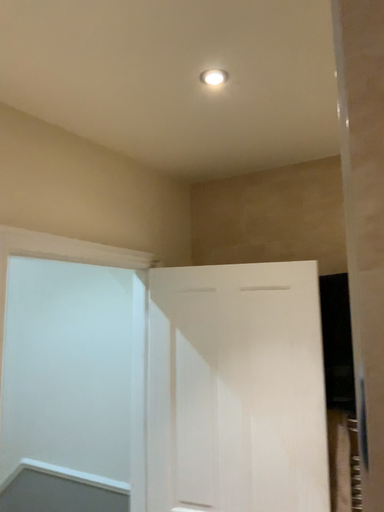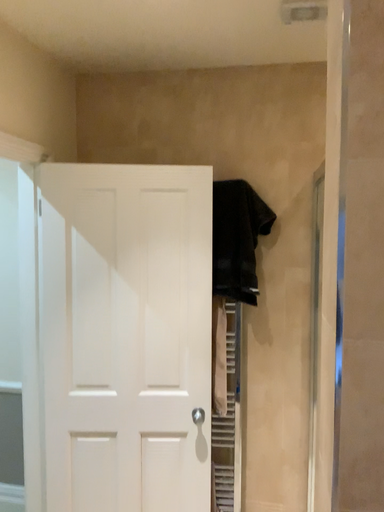
Question: Which way did the camera rotate in the video?

Choices:
 (A) rotated upward
 (B) rotated downward

Answer: (B)